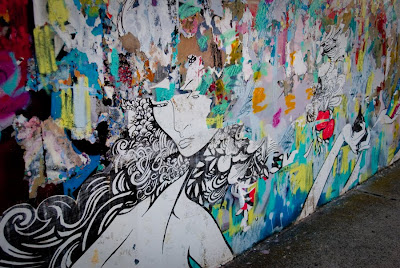
The height and width of the screenshot is (268, 400). What are the coordinates of `yellow paint` in the screenshot? It's located at (47, 51), (55, 15), (67, 116), (302, 175), (344, 160).